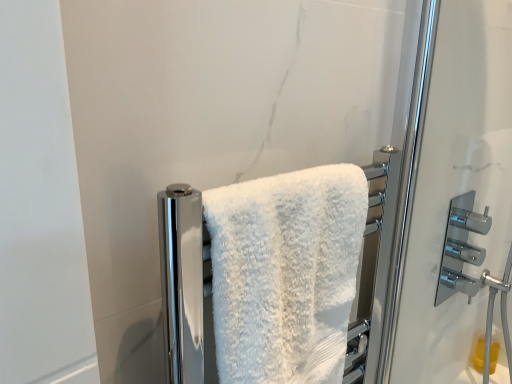
Question: Is polished chrome faucet at right positioned with its back to white fluffy towel at center?

Choices:
 (A) yes
 (B) no

Answer: (B)

Question: Are polished chrome faucet at right and white fluffy towel at center located far from each other?

Choices:
 (A) no
 (B) yes

Answer: (A)

Question: Is polished chrome faucet at right with white fluffy towel at center?

Choices:
 (A) yes
 (B) no

Answer: (B)

Question: Is polished chrome faucet at right located outside white fluffy towel at center?

Choices:
 (A) no
 (B) yes

Answer: (B)

Question: Considering the relative sizes of polished chrome faucet at right and white fluffy towel at center in the image provided, is polished chrome faucet at right wider than white fluffy towel at center?

Choices:
 (A) yes
 (B) no

Answer: (B)

Question: Can you confirm if polished chrome faucet at right is taller than white fluffy towel at center?

Choices:
 (A) no
 (B) yes

Answer: (A)

Question: Would you say white fluffy towel at center contains polished chrome faucet at right?

Choices:
 (A) yes
 (B) no

Answer: (B)

Question: From the image's perspective, is white fluffy towel at center below polished chrome faucet at right?

Choices:
 (A) no
 (B) yes

Answer: (B)

Question: From the image's perspective, would you say white fluffy towel at center is positioned over polished chrome faucet at right?

Choices:
 (A) yes
 (B) no

Answer: (B)

Question: Considering the relative positions of white fluffy towel at center and polished chrome faucet at right in the image provided, is white fluffy towel at center to the right of polished chrome faucet at right from the viewer's perspective?

Choices:
 (A) no
 (B) yes

Answer: (A)

Question: Can you see white fluffy towel at center touching polished chrome faucet at right?

Choices:
 (A) yes
 (B) no

Answer: (B)

Question: Can you confirm if white fluffy towel at center is bigger than polished chrome faucet at right?

Choices:
 (A) yes
 (B) no

Answer: (A)

Question: In terms of size, does polished chrome faucet at right appear bigger or smaller than white fluffy towel at center?

Choices:
 (A) big
 (B) small

Answer: (B)